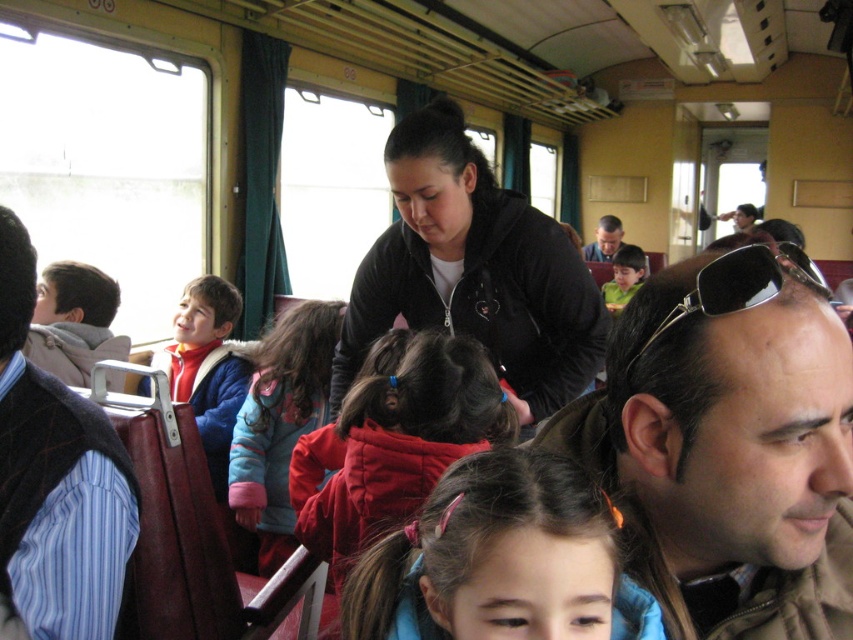
Is blue striped shirt at left smaller than matte green shirt at center?

Yes, blue striped shirt at left is smaller than matte green shirt at center.

Who is more forward, [105,506] or [643,266]?

Positioned in front is point [105,506].

The height and width of the screenshot is (640, 853). What do you see at coordinates (55, 480) in the screenshot?
I see `blue striped shirt at left` at bounding box center [55, 480].

Where is `blue striped shirt at left`? blue striped shirt at left is located at coordinates (55, 480).

Which is behind, point (256, 432) or point (701, 298)?

Point (256, 432)

Does point (274, 385) come behind point (643, 344)?

Yes.

Locate an element on the screen. The image size is (853, 640). fluffy pink jacket at center is located at coordinates (280, 422).

Is point (287, 372) positioned in front of point (624, 252)?

Yes.

Does fluffy pink jacket at center have a greater width compared to matte green shirt at center?

In fact, fluffy pink jacket at center might be narrower than matte green shirt at center.

Where is `fluffy pink jacket at center`? fluffy pink jacket at center is located at coordinates click(280, 422).